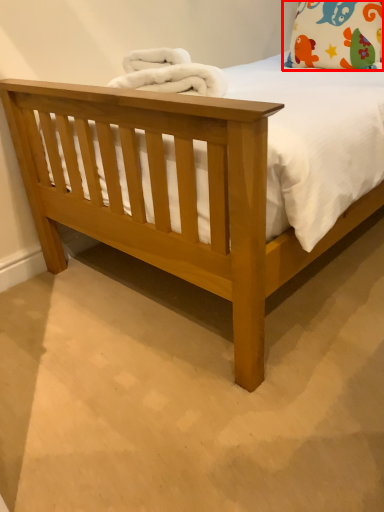
Question: Considering the relative positions of pillow (annotated by the red box) and material in the image provided, where is pillow (annotated by the red box) located with respect to the staircase?

Choices:
 (A) right
 (B) left

Answer: (A)